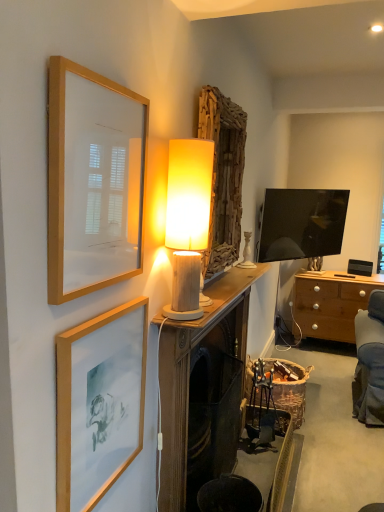
At what (x,y) coordinates should I click in order to perform the action: click on free space in front of wooden chest of drawers at right. Please return your answer as a coordinate pair (x, y). Image resolution: width=384 pixels, height=512 pixels. Looking at the image, I should click on (330, 368).